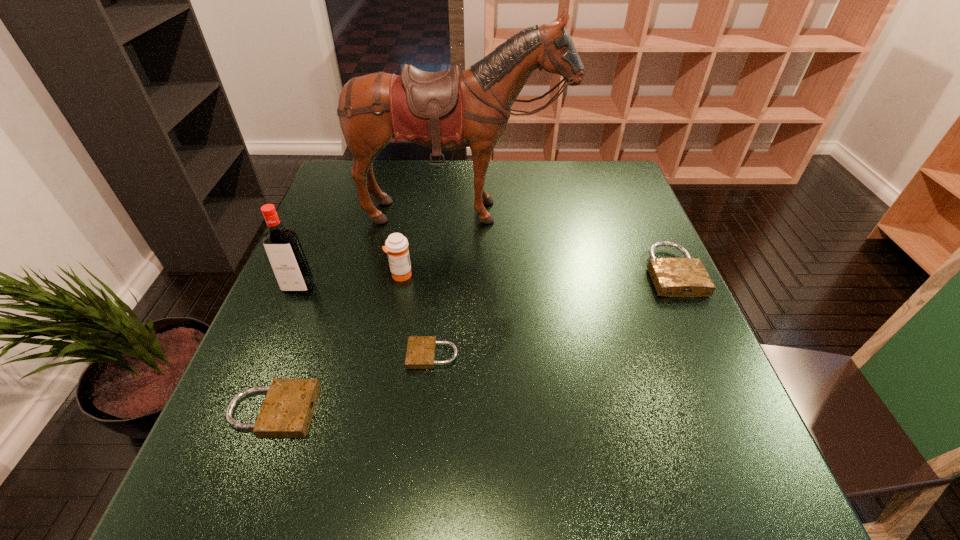
Find the location of a particular element. free spot between the farthest padlock and the second padlock from left to right is located at coordinates (553, 313).

I want to click on vacant space that is in between the nearest padlock and the farthest object, so click(368, 312).

Point out which object is positioned as the fourth nearest to the nearest padlock. Please provide its 2D coordinates. Your answer should be formatted as a tuple, i.e. [(x, y)], where the tuple contains the x and y coordinates of a point satisfying the conditions above.

[(448, 110)]

You are a GUI agent. You are given a task and a screenshot of the screen. Output one action in this format:
    pyautogui.click(x=<x>, y=<y>)
    Task: Click on the object that ranks as the closest to the nearest padlock
    The image size is (960, 540).
    Given the screenshot: What is the action you would take?
    pyautogui.click(x=421, y=350)

Locate which padlock is the second closest to the medicine. Please provide its 2D coordinates. Your answer should be formatted as a tuple, i.e. [(x, y)], where the tuple contains the x and y coordinates of a point satisfying the conditions above.

[(288, 407)]

Identify which padlock is the closest to the medicine. Please provide its 2D coordinates. Your answer should be formatted as a tuple, i.e. [(x, y)], where the tuple contains the x and y coordinates of a point satisfying the conditions above.

[(421, 350)]

This screenshot has height=540, width=960. Identify the location of free space that satisfies the following two spatial constraints: 1. on the back of the farthest object; 2. on the keyhole side of the shortest padlock. (455, 355).

You are a GUI agent. You are given a task and a screenshot of the screen. Output one action in this format:
    pyautogui.click(x=<x>, y=<y>)
    Task: Click on the vacant space that satisfies the following two spatial constraints: 1. on the back of the tallest object; 2. on the keyhole side of the nearest padlock
    Image resolution: width=960 pixels, height=540 pixels.
    Given the screenshot: What is the action you would take?
    pyautogui.click(x=452, y=411)